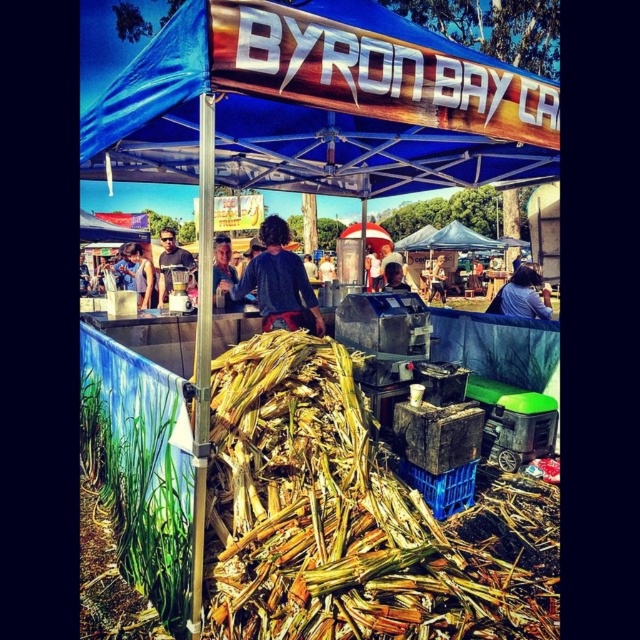
Question: Which object is positioned closest to the matte black blender at center?

Choices:
 (A) blue fabric canopy at upper center
 (B) matte black shirt at center
 (C) brown/crumbly corn at center

Answer: (B)

Question: Is blue fabric canopy at upper center thinner than matte black shirt at center?

Choices:
 (A) yes
 (B) no

Answer: (B)

Question: Is brown/crumbly corn at center to the right of smooth skin person at center from the viewer's perspective?

Choices:
 (A) yes
 (B) no

Answer: (B)

Question: Which object is positioned farthest from the blue fabric canopy at upper center?

Choices:
 (A) matte black blender at center
 (B) matte black shirt at center
 (C) smooth skin person at center

Answer: (C)

Question: Which point is farther from the camera taking this photo?

Choices:
 (A) (144, 272)
 (B) (92, 115)
 (C) (442, 289)

Answer: (C)

Question: Is blue fabric canopy at upper center wider than smooth skin person at center?

Choices:
 (A) yes
 (B) no

Answer: (A)